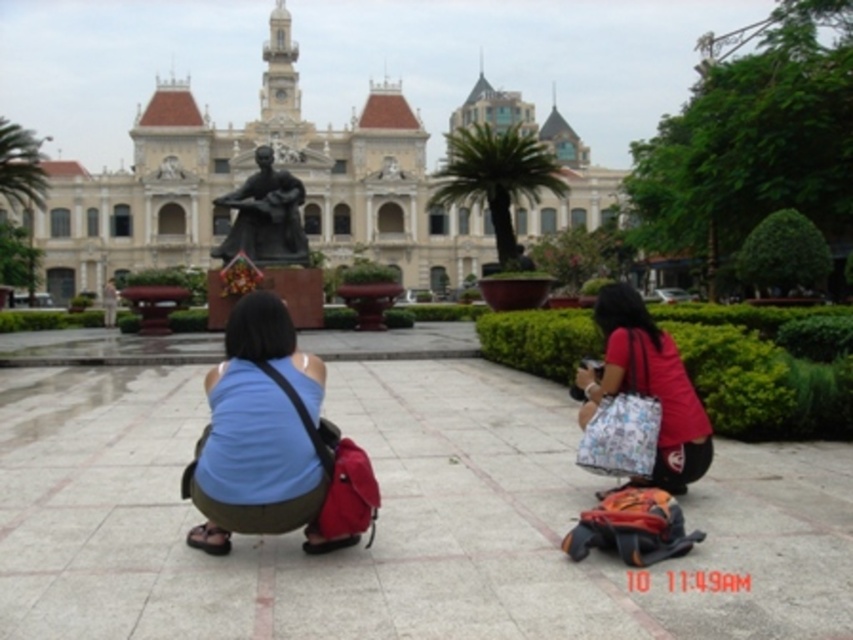
You are standing in the plaza and want to take a photo of both the blue fabric tank top at center and the matte red shirt at lower right. Which one should you focus on first to ensure both are in the frame?

You should focus on the blue fabric tank top at center first since it is closer to you than the matte red shirt at lower right, ensuring both are in the frame by adjusting the camera angle accordingly.

You are standing in the plaza and want to take a photo of the blue fabric tank top at center. Considering the distance, will you need to use a zoom lens to capture it clearly?

The blue fabric tank top at center is 69.54 meters away from the viewer. Since this distance is quite far, using a zoom lens would be necessary to capture it clearly.